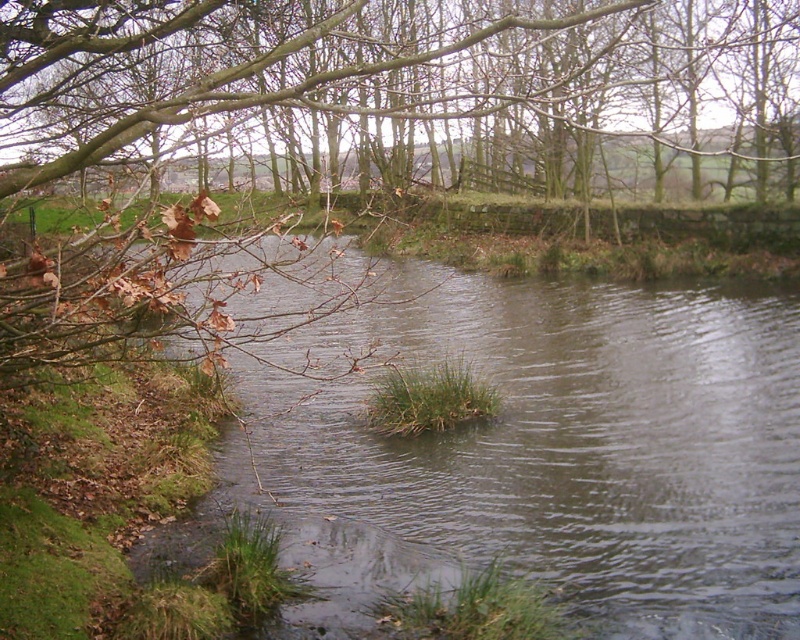
You are a bird flying over the river. You see the brown leafy branches at upper left and the clear water at center. Which object is higher in the scene?

The brown leafy branches at upper left are higher than the clear water at center because they are positioned above it.

You are an environmental scientist assessing water quality in the river. You notice the brown leafy branches at upper left and the clear water at center. Which object in the scene is bigger in size?

The brown leafy branches at upper left has a larger size compared to the clear water at center, so the brown leafy branches at upper left is bigger in size.

You are an environmental scientist assessing water quality in the river. You observe the brown leafy branches at upper left and the clear water at center. Which object has a greater width in the image?

The brown leafy branches at upper left have a greater width than the clear water at center according to the description.